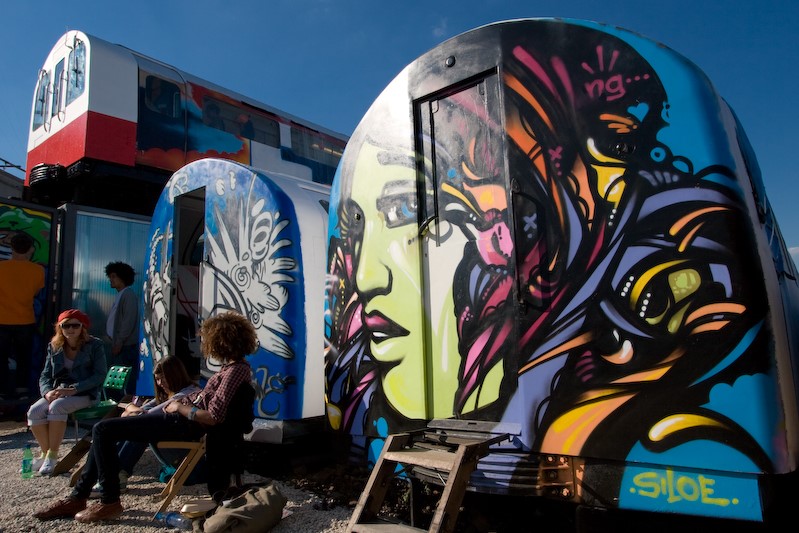
Where is `closed door`? The width and height of the screenshot is (799, 533). closed door is located at coordinates (479, 250).